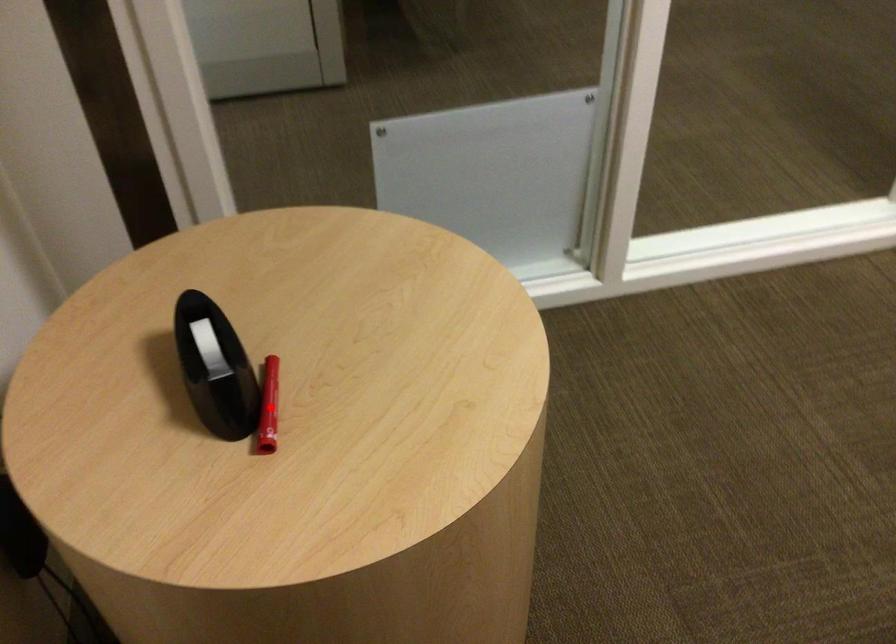
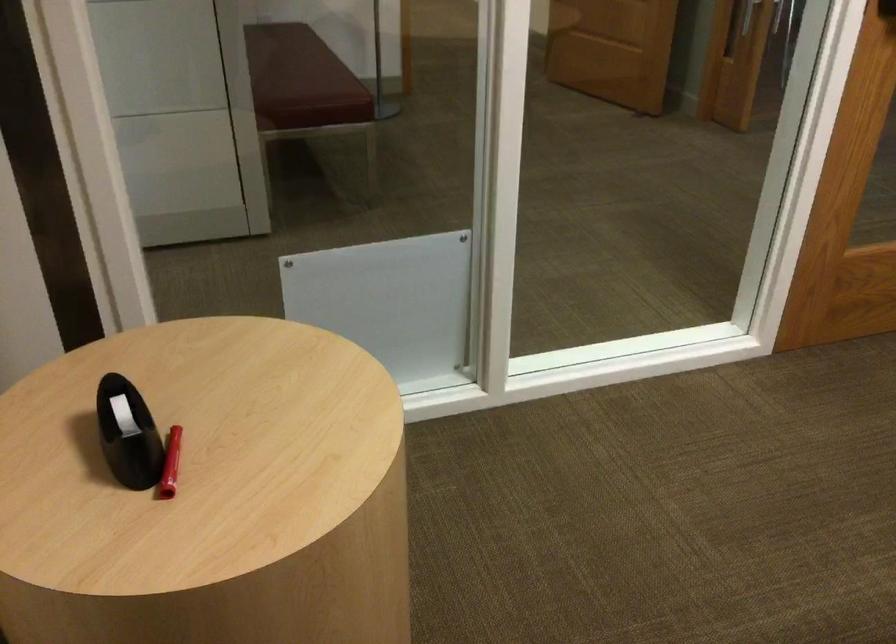
Locate, in the second image, the point that corresponds to the highlighted location in the first image.

(170, 464)